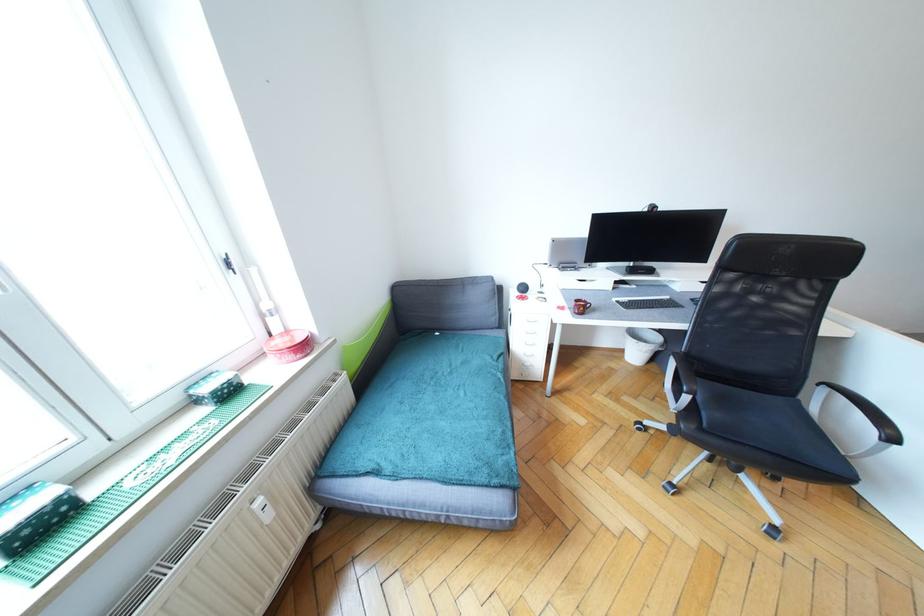
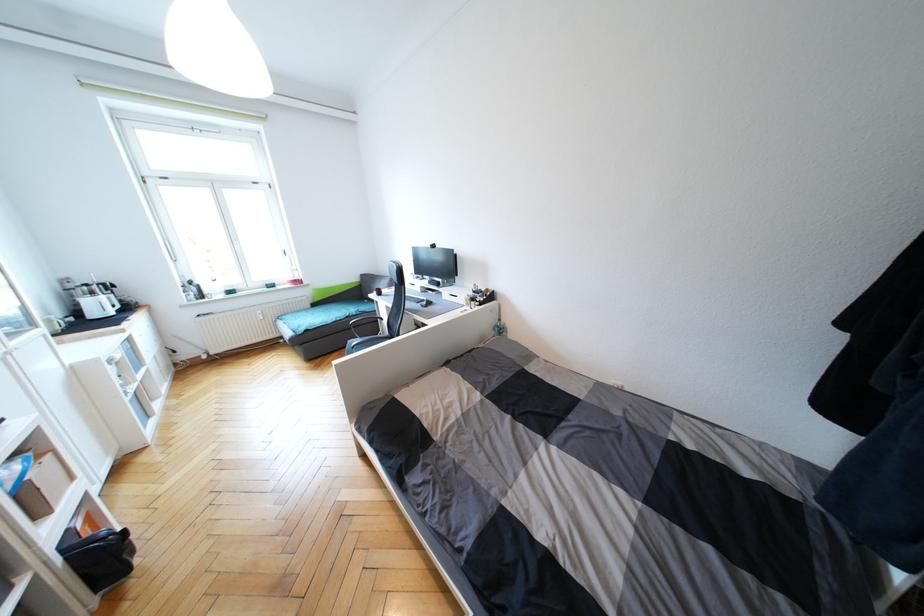
Question: I am providing you with two images of the same scene from different viewpoints. After the viewpoint changes to image2, which objects are now occluded?

Choices:
 (A) brown mug handle
 (B) sofa armrest
 (C) white mug
 (D) black chair sitting surface

Answer: (A)